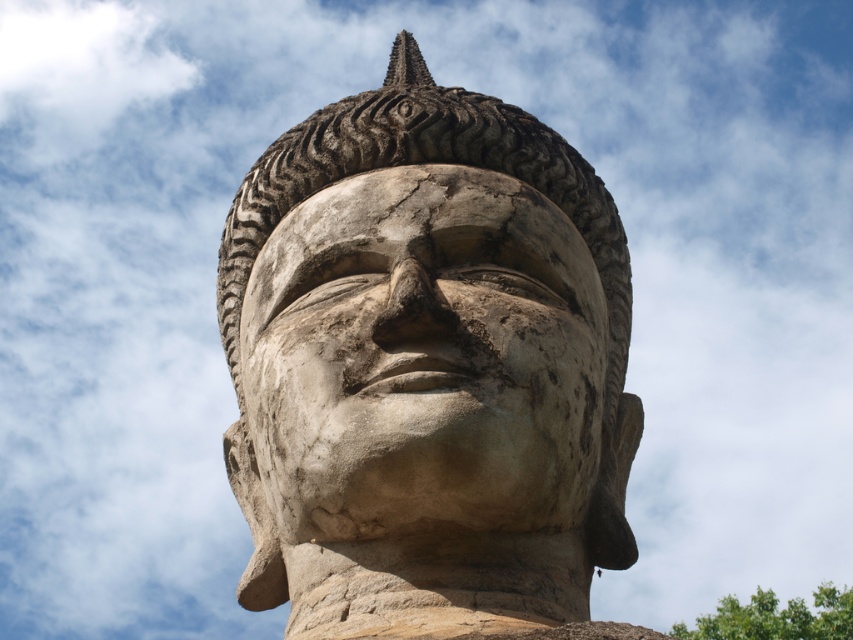
Where is the stone statue at center located in the image?

The stone statue at center is located at point (x=426, y=368) in the image.

You are an art conservator examining the stone statue at center and the weathered stone face at center. Which object would require more material to create a replica? Explain your reasoning based on their sizes.

The stone statue at center is larger in size than the weathered stone face at center, so creating a replica of the stone statue at center would require more material because it has a greater volume.

You are standing in front of a stone sculpture of a Buddha. A point at coordinates (426, 368) marks the stone statue at center. If you were to walk directly towards the statue, which direction should you move relative to your current position?

The point at coordinates (426, 368) marks the stone statue at center, so you should move forward towards the center to reach the statue.